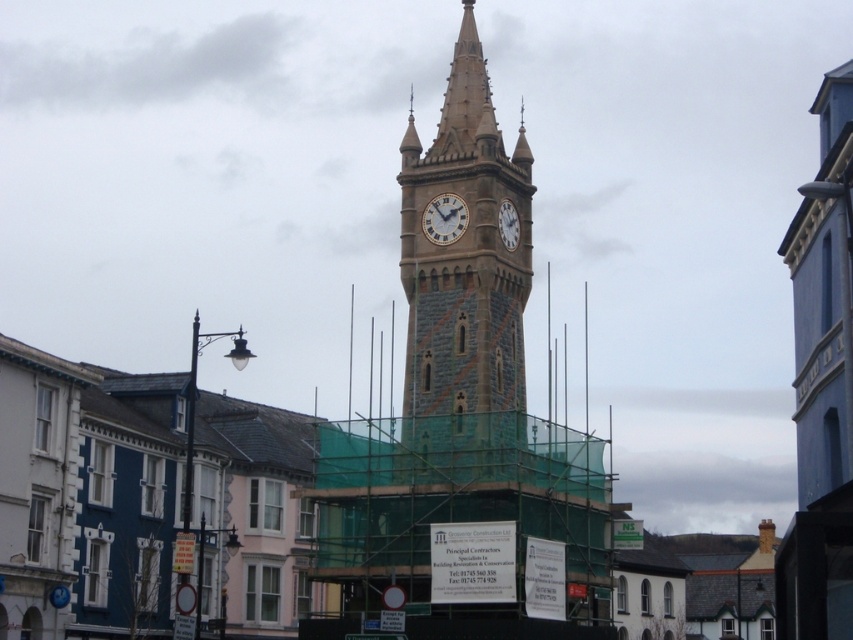
You are a maintenance worker needing to reach both the stone clock tower at center and the white painted clock face at center for repairs. Given that your ladder can extend up to 6 meters, can you safely reach both areas without moving the ladder?

The stone clock tower at center and white painted clock face at center are 6.67 meters apart from each other. Since your ladder only extends up to 6 meters, you cannot safely reach both areas without moving the ladder because the distance between them exceeds the ladder length.

You are an architect evaluating the proportions of the clock tower in the scene. Given that the white textured clock at center is 3 meters in diameter, can you estimate the minimum height of the stone clock tower at center?

The stone clock tower at center is taller than the white textured clock at center, which has a diameter of 3 meters. Since the tower is significantly taller than its clock face, the minimum height of the stone clock tower at center would be greater than 3 meters.

You are standing in the town square and want to take a photo of the clock tower. The white painted clock face at center and the white textured clock at center are both in your view. How far apart are these two elements in feet?

The white painted clock face at center is 13.15 feet away from the white textured clock at center.